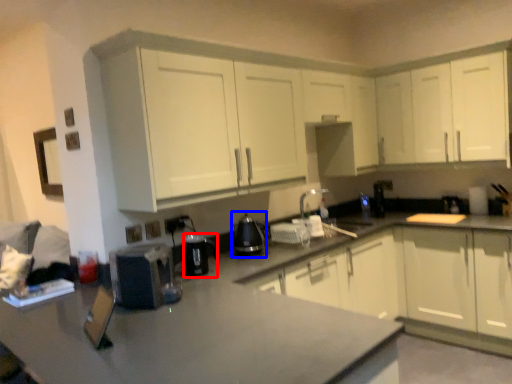
Question: Which of the following is the farthest to the observer, appliance (highlighted by a red box) or appliance (highlighted by a blue box)?

Choices:
 (A) appliance
 (B) appliance

Answer: (B)